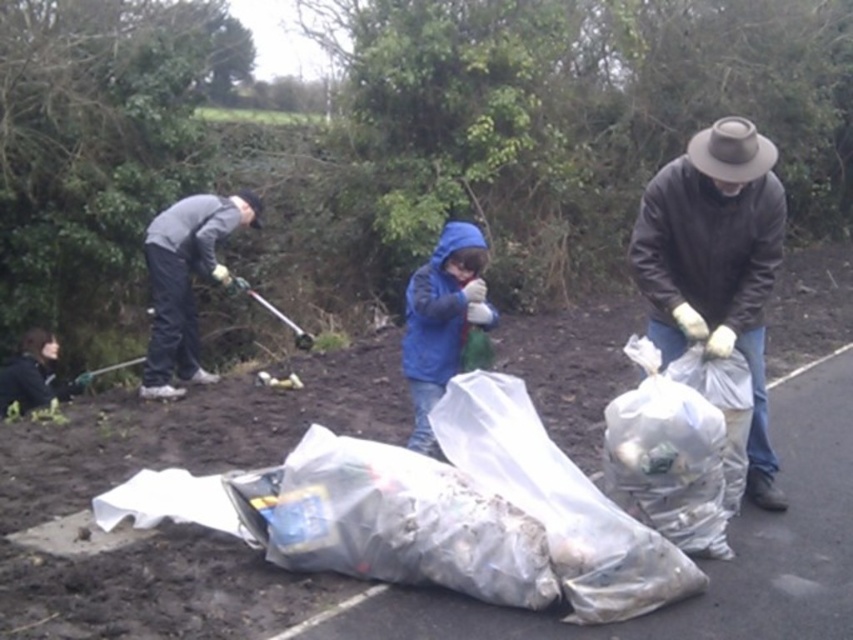
Can you confirm if gray fabric jacket at left is bigger than brown felt cowboy hat at upper right?

Yes, gray fabric jacket at left is bigger than brown felt cowboy hat at upper right.

Is gray fabric jacket at left below brown felt cowboy hat at upper right?

Correct, gray fabric jacket at left is located below brown felt cowboy hat at upper right.

Is point (235, 211) farther from viewer compared to point (747, 129)?

That is True.

Find the location of a particular element. This screenshot has width=853, height=640. gray fabric jacket at left is located at coordinates (186, 282).

Between point (303, 436) and point (733, 192), which one is positioned in front?

Point (733, 192)

Locate an element on the screen. transparent plastic bag at center is located at coordinates (393, 520).

At what (x,y) coordinates should I click in order to perform the action: click on dark brown leather jacket at right. Please return your answer as a coordinate pair (x, y). Looking at the image, I should click on (717, 262).

Which is in front, point (724, 212) or point (187, 273)?

Point (724, 212) is more forward.

Where is `dark brown leather jacket at right`? This screenshot has width=853, height=640. dark brown leather jacket at right is located at coordinates (717, 262).

At what (x,y) coordinates should I click in order to perform the action: click on dark brown leather jacket at right. Please return your answer as a coordinate pair (x, y). Looking at the image, I should click on (717, 262).